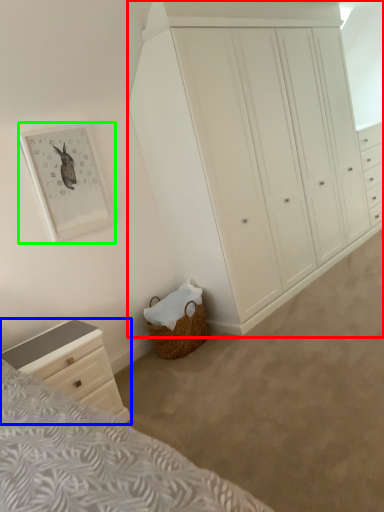
Question: Which object is positioned farthest from chest of drawers (highlighted by a red box)? Select from chest of drawers (highlighted by a blue box) and picture frame (highlighted by a green box).

Choices:
 (A) chest of drawers
 (B) picture frame

Answer: (A)